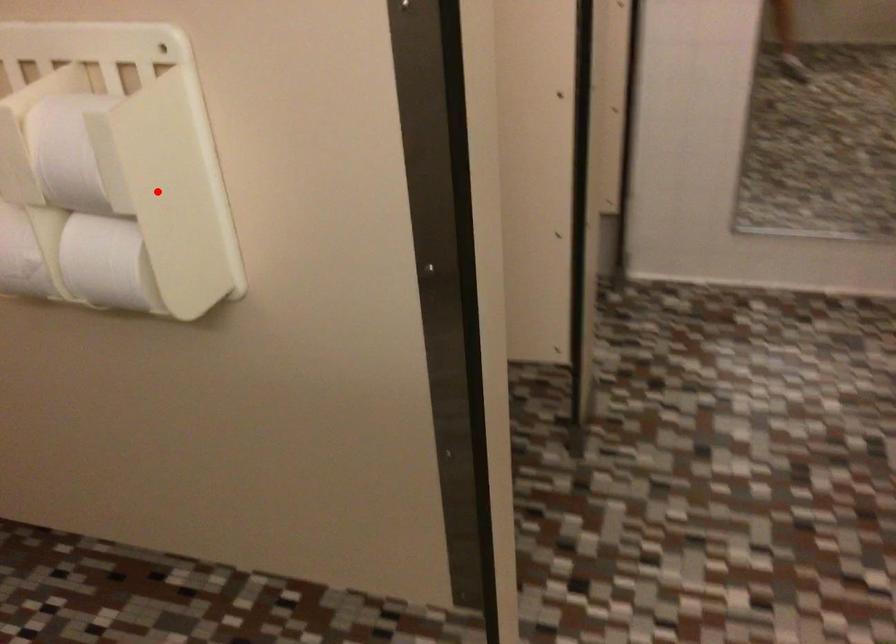
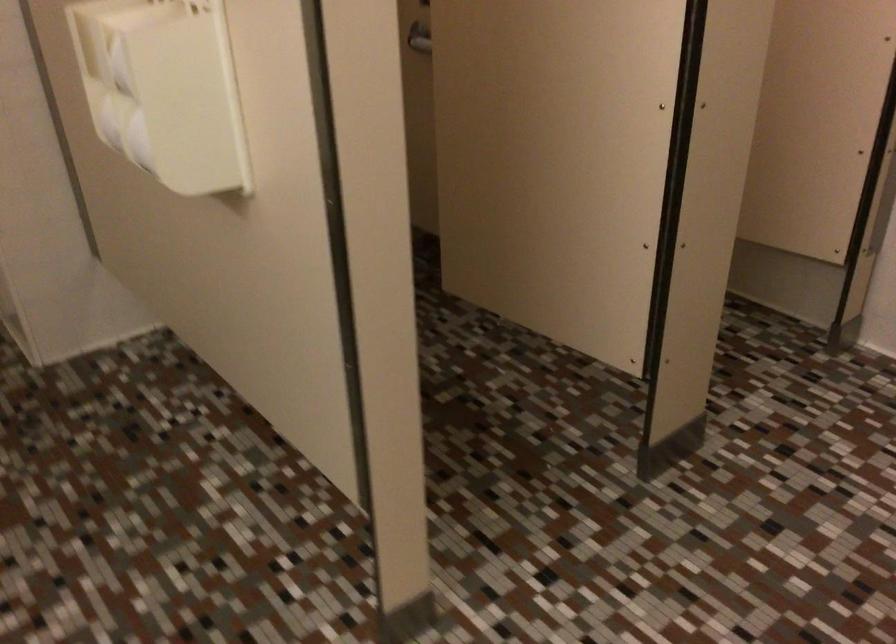
Locate, in the second image, the point that corresponds to the highlighted location in the first image.

(164, 90)